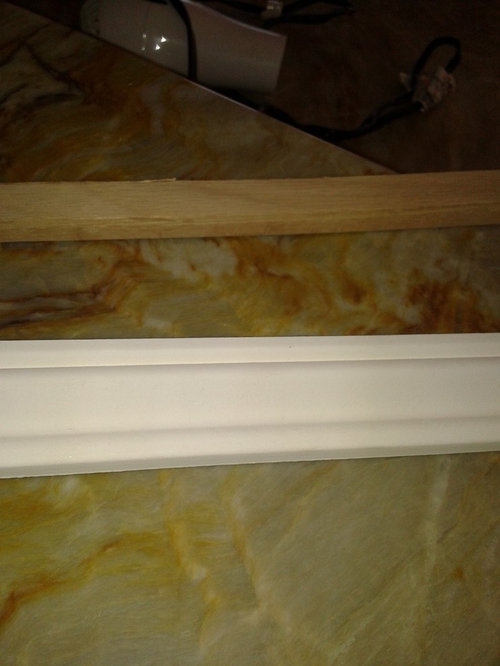
Locate an element on the screen. This screenshot has width=500, height=666. power plug is located at coordinates (271, 11).